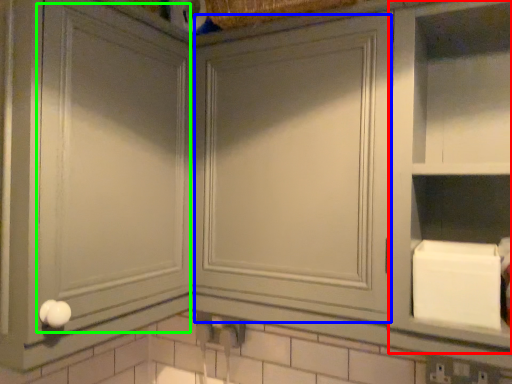
Question: Which object is positioned farthest from cabinet (highlighted by a red box)? Select from glass door (highlighted by a blue box) and glass door (highlighted by a green box).

Choices:
 (A) glass door
 (B) glass door

Answer: (B)